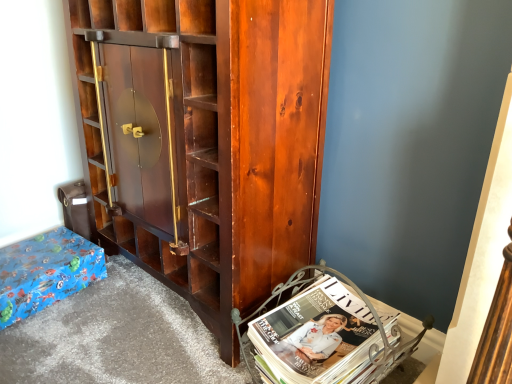
Question: Based on their positions, is shiny dark wood cabinet at center located to the left or right of white glossy magazine at lower right?

Choices:
 (A) left
 (B) right

Answer: (A)

Question: In terms of width, does shiny dark wood cabinet at center look wider or thinner when compared to white glossy magazine at lower right?

Choices:
 (A) thin
 (B) wide

Answer: (B)

Question: Which object is the closest to the blue wrapping paper at lower left?

Choices:
 (A) shiny dark wood cabinet at center
 (B) white glossy magazine at lower right

Answer: (A)

Question: Estimate the real-world distances between objects in this image. Which object is closer to the blue wrapping paper at lower left?

Choices:
 (A) shiny dark wood cabinet at center
 (B) white glossy magazine at lower right

Answer: (A)